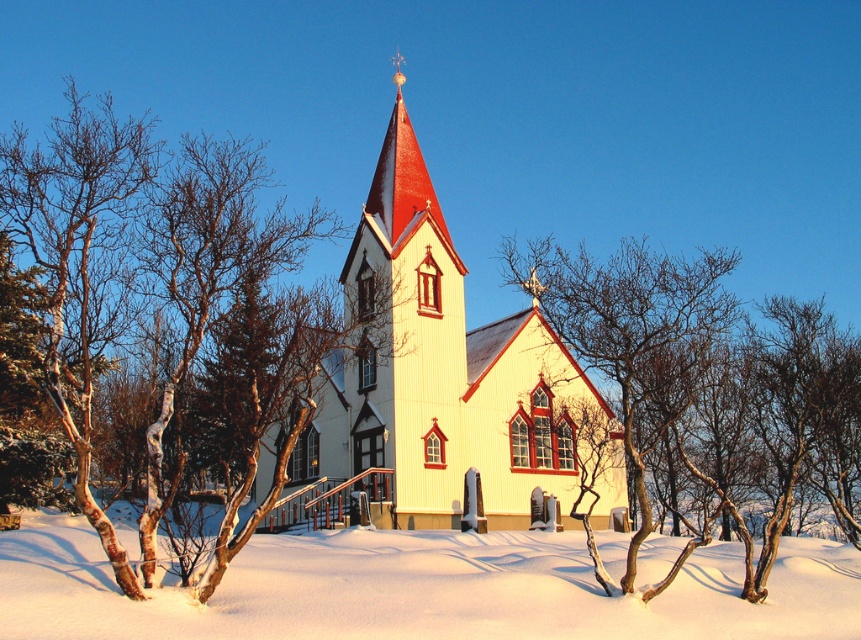
Question: Which object is closer to the camera taking this photo?

Choices:
 (A) white bark tree at center
 (B) white powdery snow at center

Answer: (B)

Question: Does white wood church at center come in front of bare branches at center?

Choices:
 (A) no
 (B) yes

Answer: (A)

Question: Is white bark tree at center positioned behind white powdery snow at center?

Choices:
 (A) no
 (B) yes

Answer: (B)

Question: Can you confirm if white powdery snow at center is positioned above white wood church at center?

Choices:
 (A) no
 (B) yes

Answer: (A)

Question: Among these objects, which one is farthest from the camera?

Choices:
 (A) white wood church at center
 (B) white powdery snow at center

Answer: (A)

Question: Which point is farther to the camera?

Choices:
 (A) (360, 314)
 (B) (846, 557)

Answer: (A)